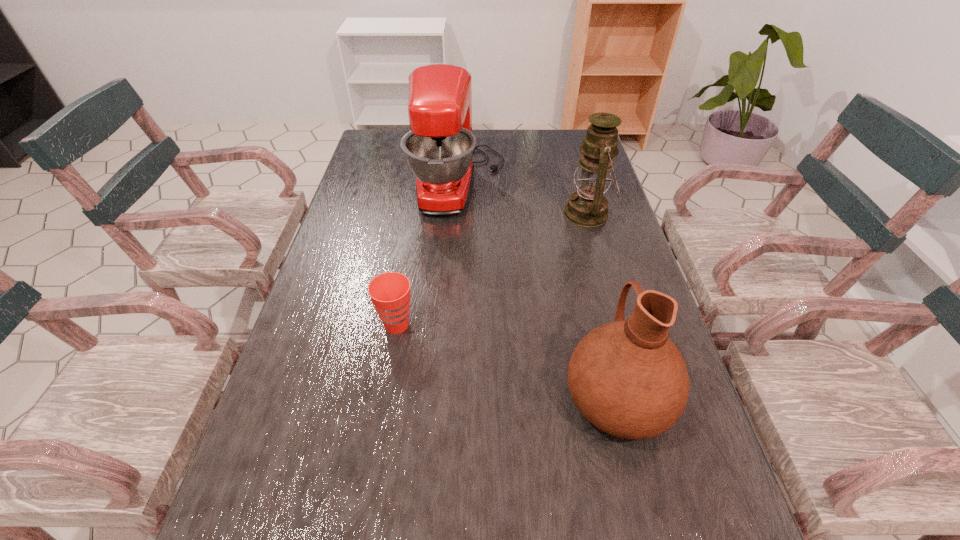
In order to click on vacant area situated on the back of the second nearest object in this screenshot , I will do `click(416, 215)`.

You are a GUI agent. You are given a task and a screenshot of the screen. Output one action in this format:
    pyautogui.click(x=<x>, y=<y>)
    Task: Click on the object at the far edge
    
    Given the screenshot: What is the action you would take?
    pyautogui.click(x=439, y=149)

Find the location of a particular element. oil lamp that is at the right edge is located at coordinates (587, 207).

I want to click on pitcher that is positioned at the right edge, so click(x=627, y=378).

This screenshot has width=960, height=540. I want to click on vacant area at the left edge of the desktop, so click(x=384, y=223).

Find the location of `free space at the right edge of the desktop`. free space at the right edge of the desktop is located at coordinates (570, 191).

Identify the location of vacant space at the far right corner of the desktop. (566, 130).

This screenshot has height=540, width=960. I want to click on free space between the cup and the kitchen mixer, so click(x=428, y=254).

You are a GUI agent. You are given a task and a screenshot of the screen. Output one action in this format:
    pyautogui.click(x=<x>, y=<y>)
    Task: Click on the free space between the oil lamp and the nearest object
    The width and height of the screenshot is (960, 540).
    Given the screenshot: What is the action you would take?
    pyautogui.click(x=603, y=305)

The width and height of the screenshot is (960, 540). I want to click on vacant space in between the kitchen mixer and the oil lamp, so click(x=523, y=199).